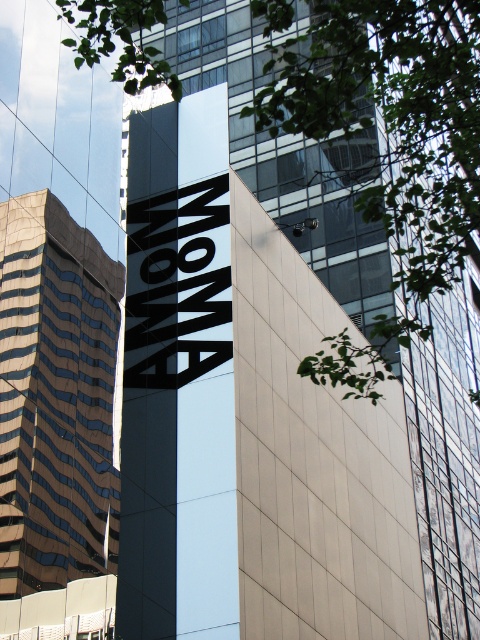
You are standing in front of the building and notice the green leafy tree at upper center and the black matte sign at center. Which object is closer to your left side when facing the building?

The black matte sign at center is closer to your left side because the green leafy tree at upper center is positioned on the right side of the black matte sign at center.

You are standing in front of the modern building with the MOMA sign. There is a point marked at coordinates (56, 397). Based on the scene description, can you determine which part of the building this point corresponds to?

The point at coordinates (56, 397) is located on the brown glass building at left.

You are standing in front of the brown glass building at left and want to take a photo of the green leafy tree at upper center. Which direction should you move to ensure the tree is in the frame?

The green leafy tree at upper center is to the right of the brown glass building at left, so you should move to the right to ensure the tree is in the frame.